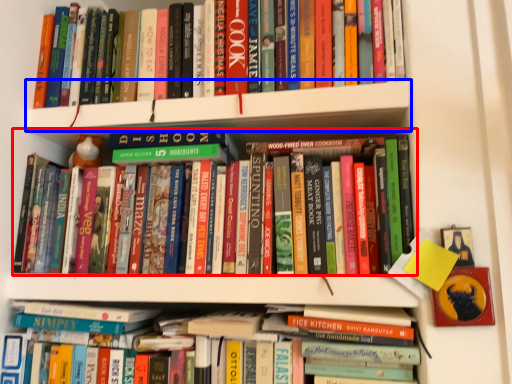
Question: Which object appears farthest to the camera in this image, book (highlighted by a red box) or shelf (highlighted by a blue box)?

Choices:
 (A) book
 (B) shelf

Answer: (B)